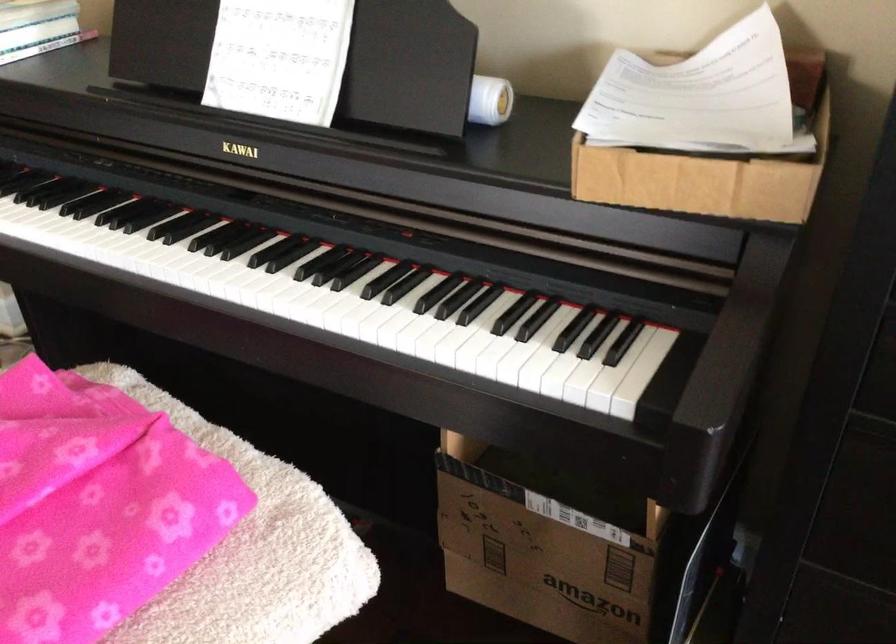
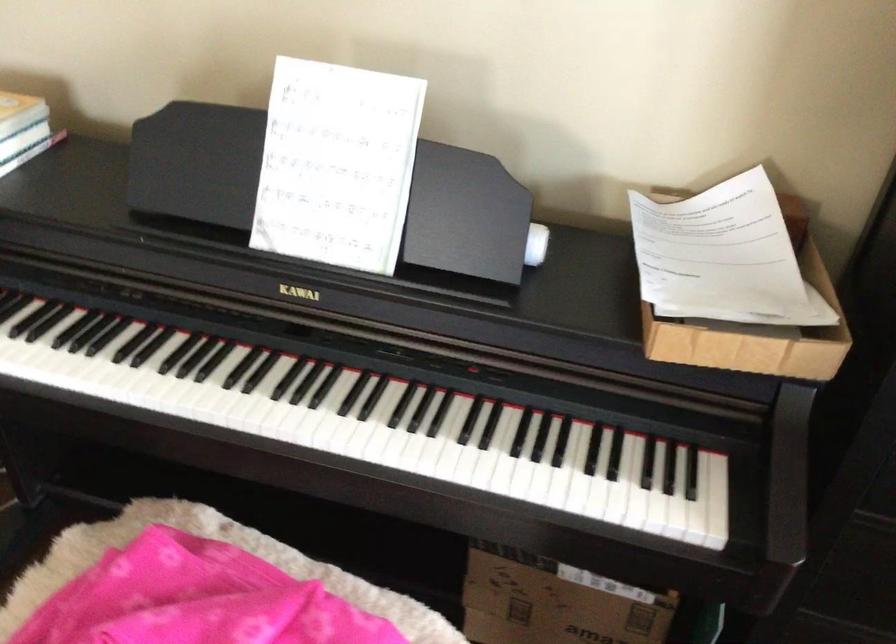
Where in the second image is the point corresponding to point (604, 337) from the first image?

(669, 467)